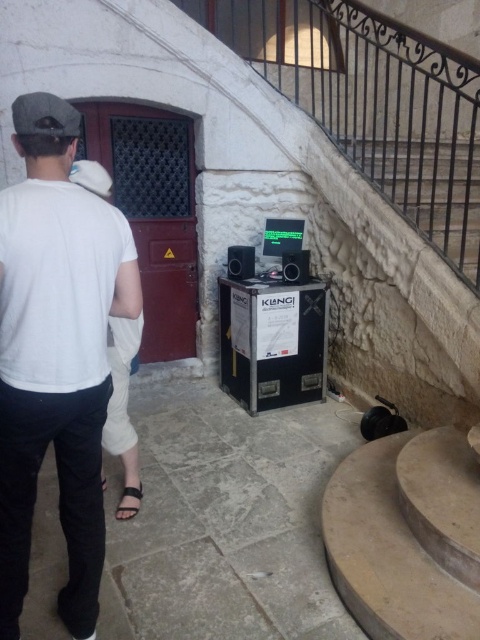
Question: Which point appears farthest from the camera in this image?

Choices:
 (A) (24, 570)
 (B) (124, 515)

Answer: (B)

Question: Is white cotton shirt at upper left wider than black leather sandal at lower left?

Choices:
 (A) yes
 (B) no

Answer: (A)

Question: Does white cotton shirt at upper left have a greater width compared to black leather sandal at lower left?

Choices:
 (A) no
 (B) yes

Answer: (B)

Question: Which object appears farthest from the camera in this image?

Choices:
 (A) black leather sandal at lower left
 (B) white cotton shirt at upper left

Answer: (A)

Question: Among these points, which one is farthest from the camera?

Choices:
 (A) (60, 326)
 (B) (124, 497)

Answer: (B)

Question: Is white cotton shirt at upper left thinner than black leather sandal at lower left?

Choices:
 (A) no
 (B) yes

Answer: (A)